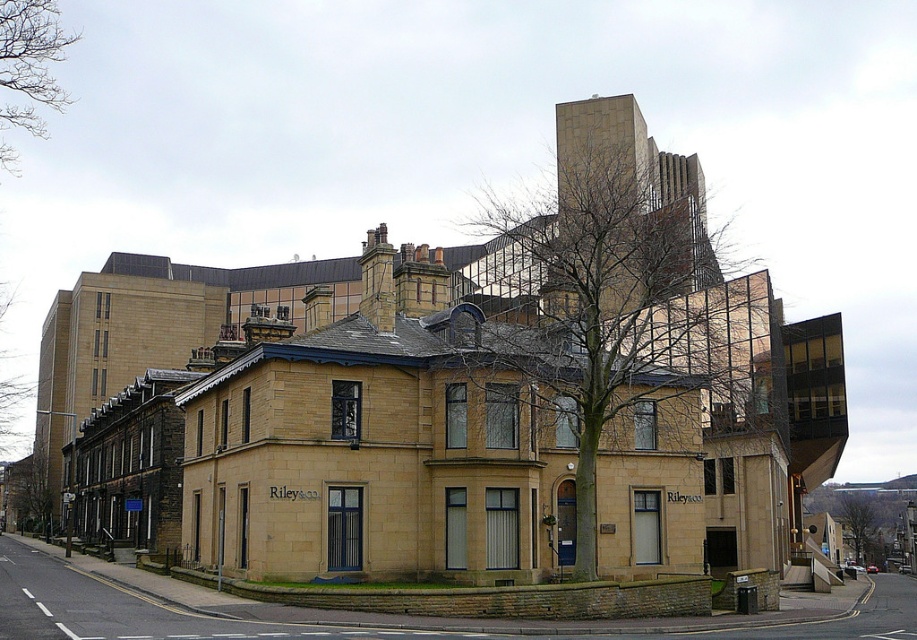
Question: Which object appears farthest from the camera in this image?

Choices:
 (A) bare branches at center
 (B) green leafy tree at center

Answer: (B)

Question: Does bare branches at center come in front of green leafy tree at center?

Choices:
 (A) yes
 (B) no

Answer: (A)

Question: Does bare branches at center have a smaller size compared to green leafy tree at center?

Choices:
 (A) no
 (B) yes

Answer: (A)

Question: Is bare branches at center wider than green leafy tree at center?

Choices:
 (A) yes
 (B) no

Answer: (B)

Question: Estimate the real-world distances between objects in this image. Which object is closer to the bare branches at upper left?

Choices:
 (A) bare branches at center
 (B) green leafy tree at center

Answer: (A)

Question: Among these objects, which one is nearest to the camera?

Choices:
 (A) bare branches at center
 (B) green leafy tree at center
 (C) bare branches at upper left

Answer: (A)